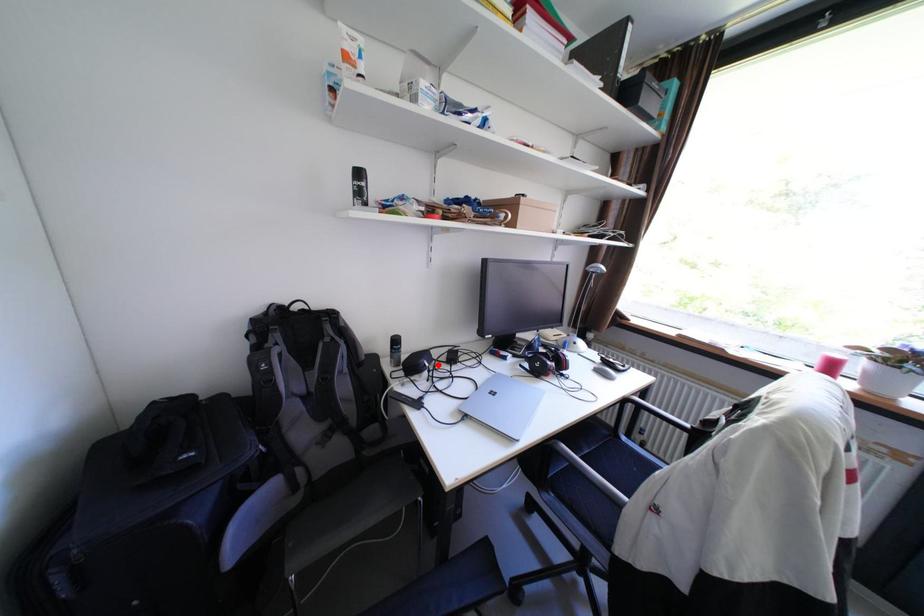
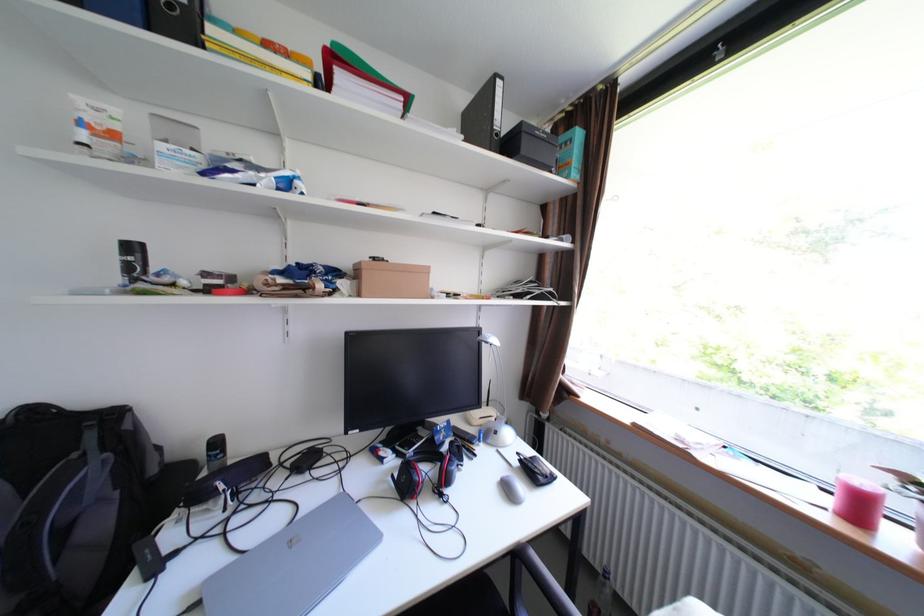
In the second image, find the point that corresponds to the highlighted location in the first image.

(233, 488)